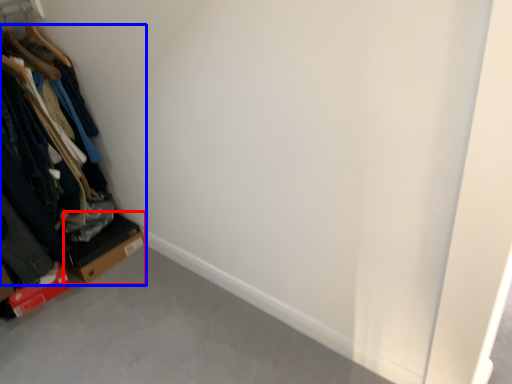
Question: Which object appears closest to the camera in this image, cardboard box (highlighted by a red box) or furniture (highlighted by a blue box)?

Choices:
 (A) cardboard box
 (B) furniture

Answer: (B)